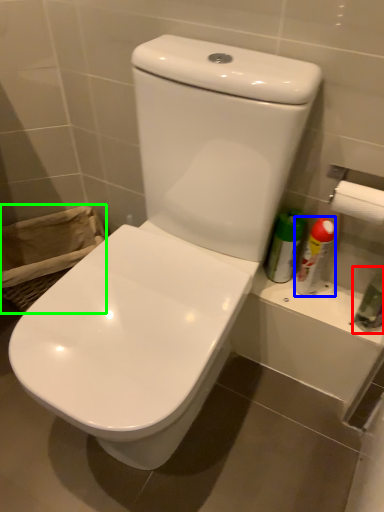
Question: Which object is positioned farthest from toiletry (highlighted by a red box)? Select from cleaning product (highlighted by a blue box) and laundry basket (highlighted by a green box).

Choices:
 (A) cleaning product
 (B) laundry basket

Answer: (B)